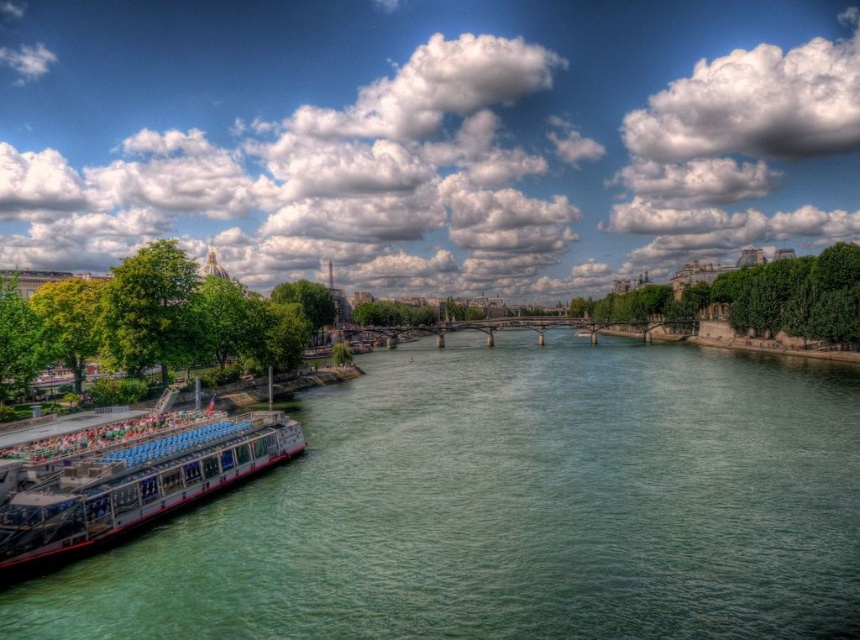
You are a photographer standing at the riverbank and want to capture both the modern boat with blue seats and the Eiffel Tower in your shot. The boat is located near the point marked at coordinates point (381, 592), and the Eiffel Tower is near point (281, 420). Since you want to ensure both are in focus, which point should you focus on first to get both in the frame?

You should focus on point (281, 420) first because it is farther away than point (381, 592). By focusing on the farther point, the closer point will also be within the depth of field, ensuring both the boat and the Eiffel Tower are in focus.

You are a tour guide leading a group near the Seine River. You need to inform your tourists about the distance between the green smooth water at lower left and the white glossy boat at lower left. What do you tell them?

The green smooth water at lower left is 23.40 meters away from the white glossy boat at lower left.

You are a tourist standing on the riverbank and want to take a photo of the white glossy boat at lower left and the green smooth water at lower left. Based on their positions, which one should you focus on first to ensure both are in the frame?

The green smooth water at lower left is in front of the white glossy boat at lower left, so you should focus on the white glossy boat at lower left first to ensure both are in the frame.